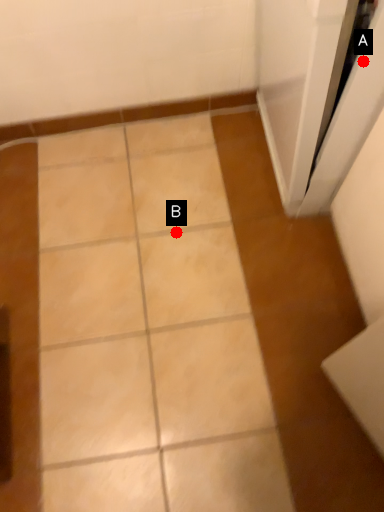
Question: Two points are circled on the image, labeled by A and B beside each circle. Among these points, which one is nearest to the camera?

Choices:
 (A) A is closer
 (B) B is closer

Answer: (A)